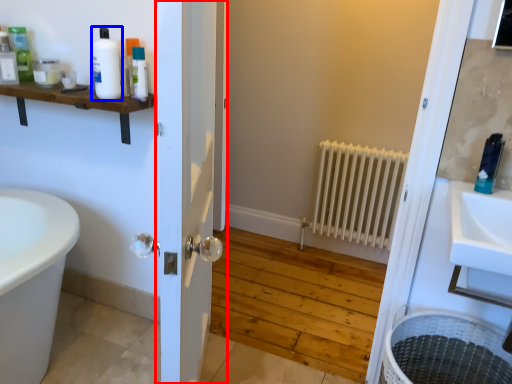
Question: Which of the following is the farthest to the observer, door (highlighted by a red box) or toiletry (highlighted by a blue box)?

Choices:
 (A) door
 (B) toiletry

Answer: (B)